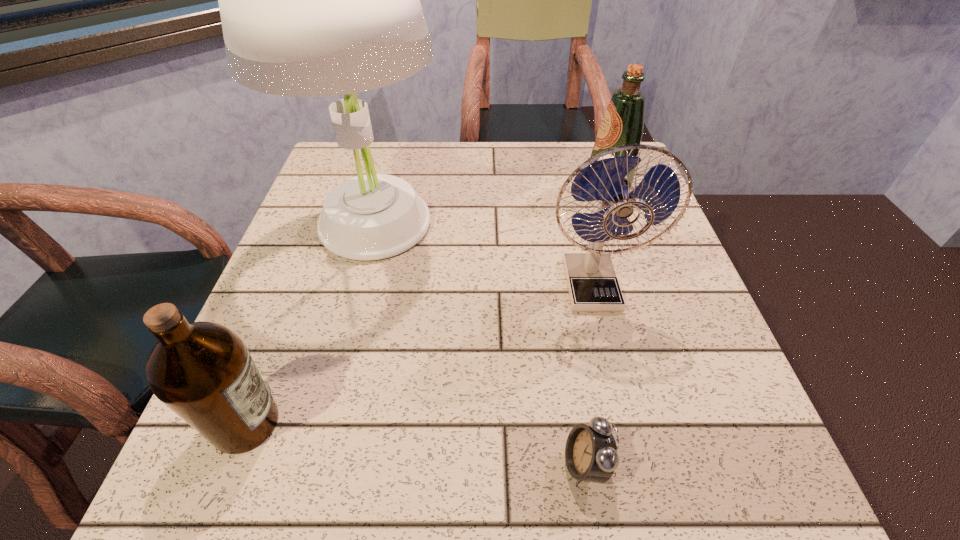
Locate an element on the screen. This screenshot has width=960, height=540. free space at the near left corner is located at coordinates (241, 459).

This screenshot has width=960, height=540. In order to click on vacant area between the shortest object and the fan in this screenshot , I will do `click(588, 375)`.

Find the location of a particular element. empty space that is in between the left olive oil and the right olive oil is located at coordinates coord(426,305).

I want to click on unoccupied position between the fan and the tallest object, so click(x=482, y=256).

This screenshot has width=960, height=540. In order to click on vacant area between the alarm clock and the farther olive oil in this screenshot , I will do `click(596, 326)`.

Identify the location of vacant space in between the farther olive oil and the left olive oil. (426, 305).

The width and height of the screenshot is (960, 540). I want to click on free space between the right olive oil and the left olive oil, so click(426, 305).

Find the location of `empty space that is in between the right olive oil and the alarm clock`. empty space that is in between the right olive oil and the alarm clock is located at coordinates (596, 326).

Identify the location of free space that is in between the left olive oil and the shortest object. The height and width of the screenshot is (540, 960). (416, 444).

This screenshot has width=960, height=540. Identify the location of free space that is in between the left olive oil and the shortest object. (416, 444).